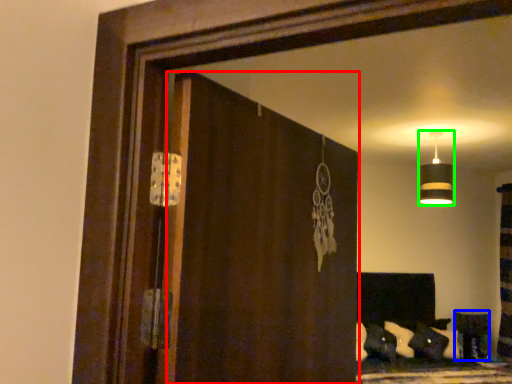
Question: Estimate the real-world distances between objects in this image. Which object is closer to screen door (highlighted by a red box), furniture (highlighted by a blue box) or lamp (highlighted by a green box)?

Choices:
 (A) furniture
 (B) lamp

Answer: (B)